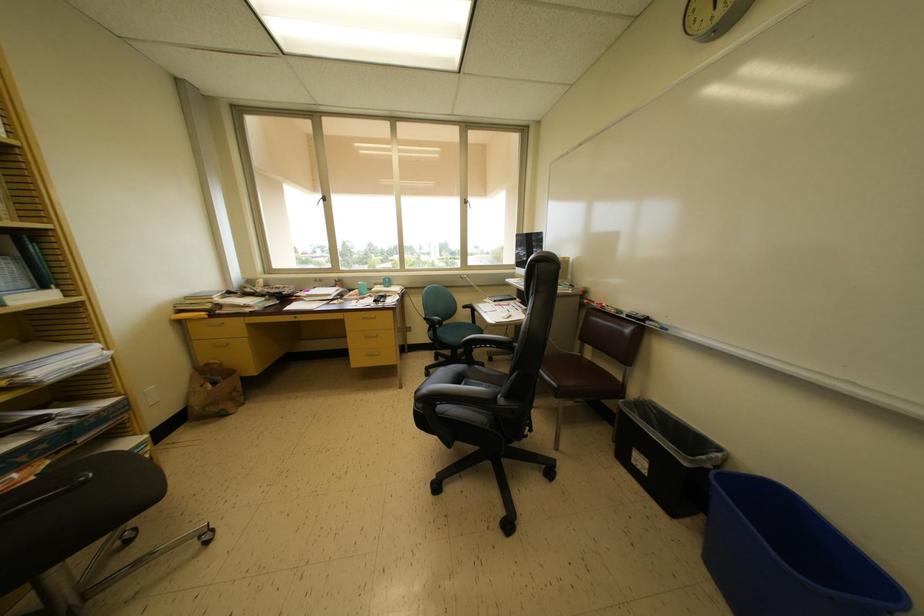
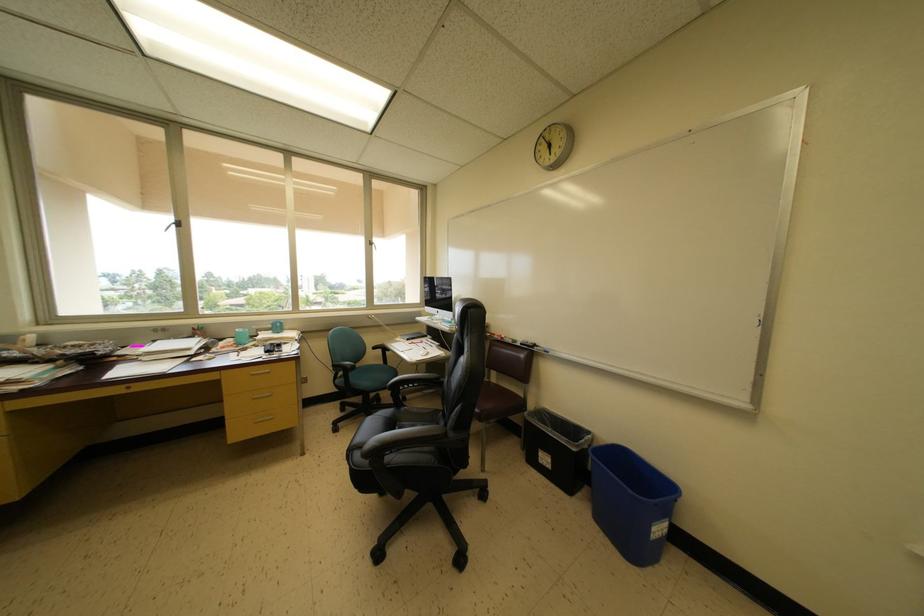
Locate, in the second image, the point that corresponds to the point at 574,569 in the first image.

(520, 573)